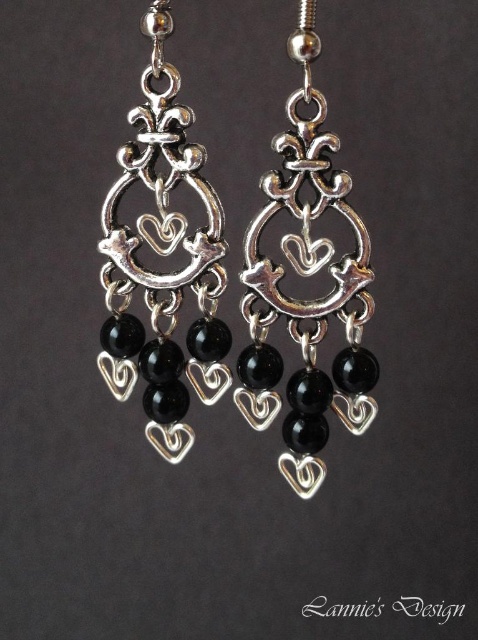
Question: Does polished silver heart-shaped pendant at center have a smaller size compared to silver/black beads at center?

Choices:
 (A) yes
 (B) no

Answer: (B)

Question: Does polished silver heart-shaped pendant at center appear on the right side of silver/black beads at center?

Choices:
 (A) no
 (B) yes

Answer: (B)

Question: Can you confirm if polished silver heart-shaped pendant at center is thinner than silver/black beads at center?

Choices:
 (A) yes
 (B) no

Answer: (B)